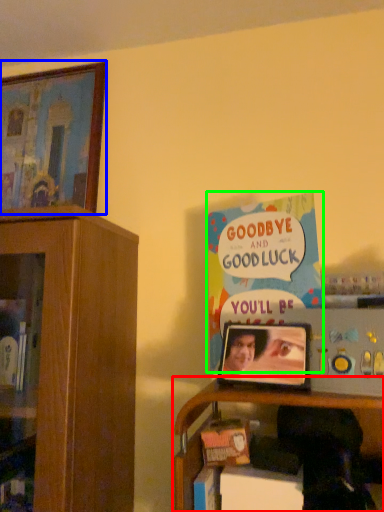
Question: Estimate the real-world distances between objects in this image. Which object is closer to shelf (highlighted by a red box), picture frame (highlighted by a blue box) or book (highlighted by a green box)?

Choices:
 (A) picture frame
 (B) book

Answer: (B)